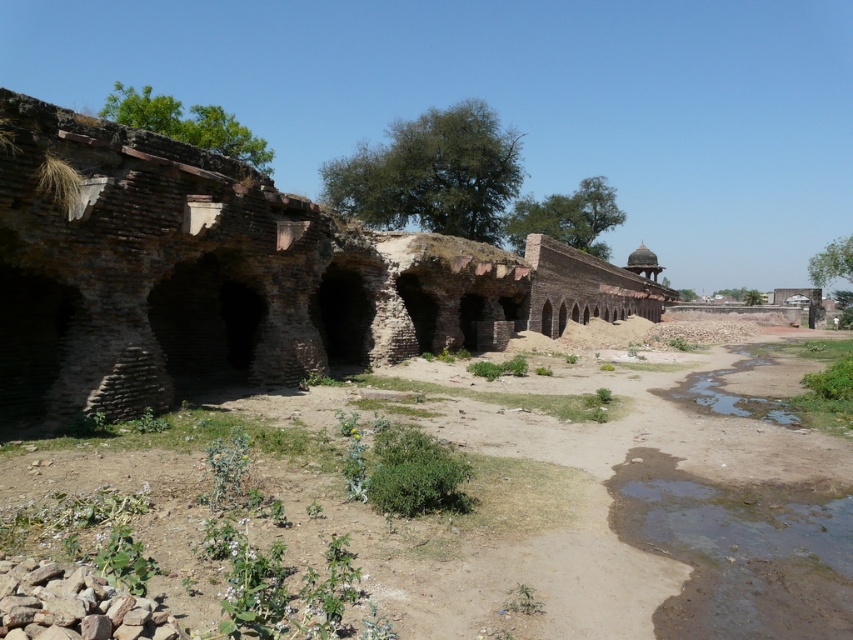
You are an archaeologist examining the ancient structure. You notice the brown sandy dirt field at center and the brown brick ruins at center. Which of these two areas is narrower in width?

The brown sandy dirt field at center has a lesser width compared to the brown brick ruins at center, so the brown sandy dirt field at center is narrower.

You are a hiker who wants to cross the brown brick ruins at center to reach the other side. However, you notice the brown sandy dirt field at center nearby. Which path would be higher and safer to walk on?

The brown brick ruins at center are higher than the brown sandy dirt field at center, so the path on the brown brick ruins at center would be safer to walk on.

You are standing in front of the ancient structure and want to take a photo that includes both the point at coordinates point (746, 422) and point (144, 328). Which point should you focus on first to ensure both are in focus?

You should focus on point (144, 328) first because it is closer to you than point (746, 422), which is further away. By focusing on the closer point, the further point will also be within the depth of field.